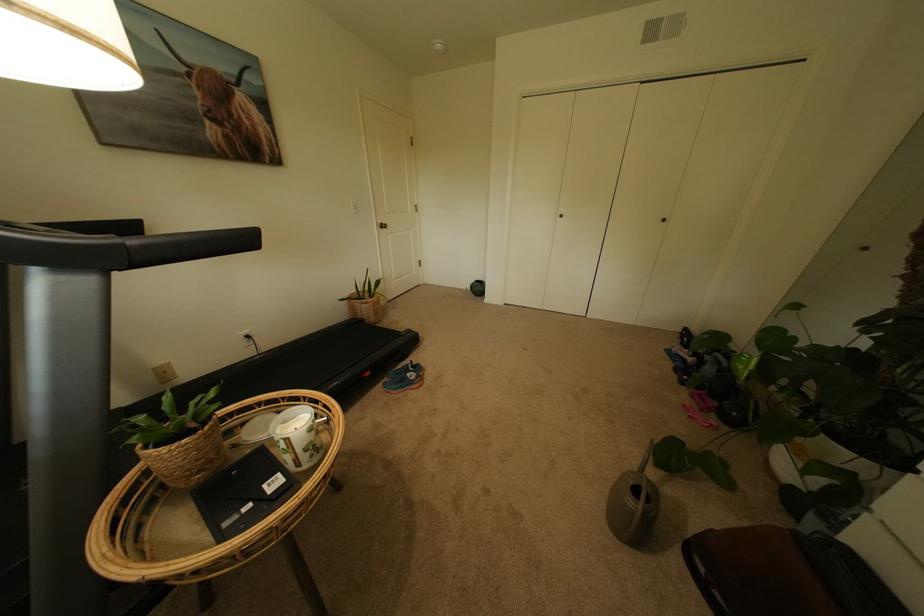
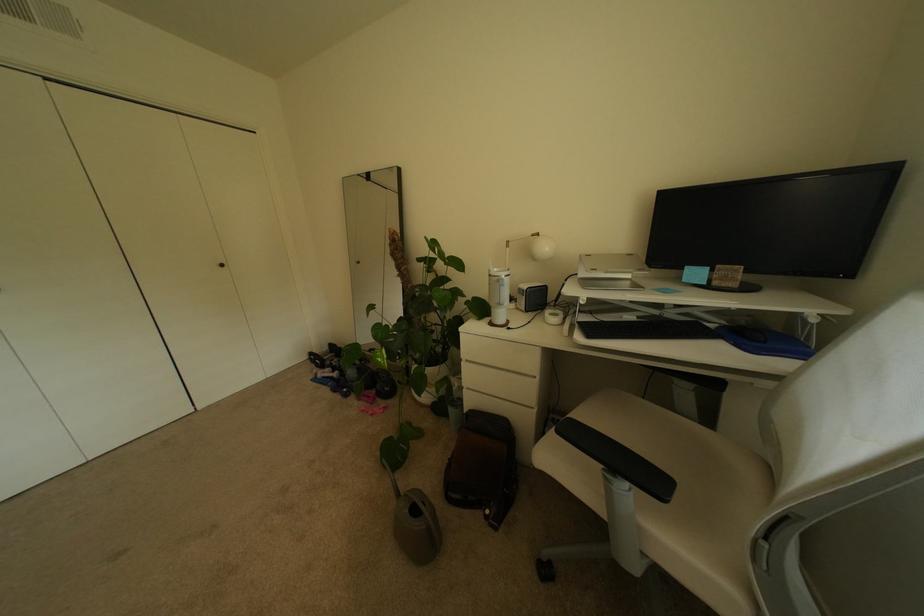
Locate, in the second image, the point that corresponds to the point at 694,362 in the first image.

(341, 379)